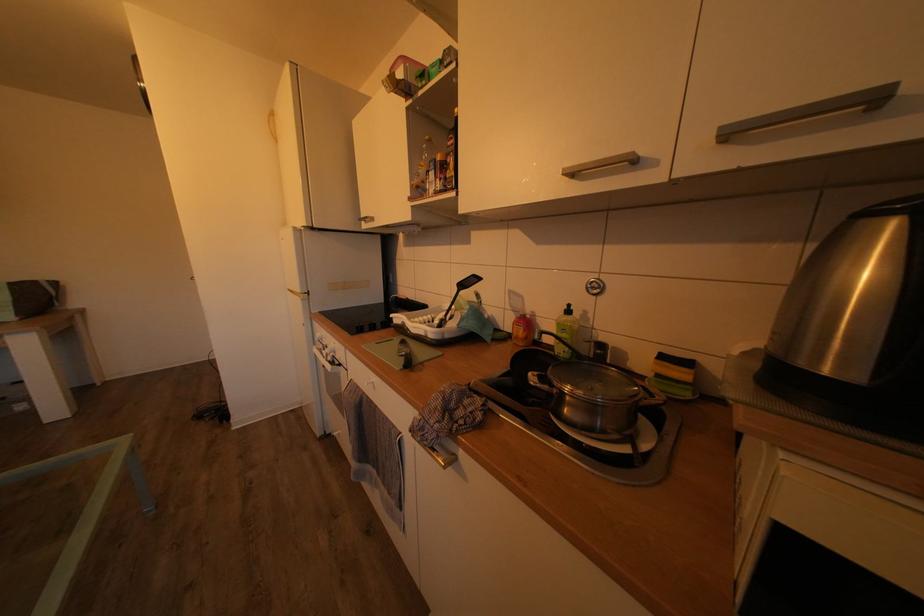
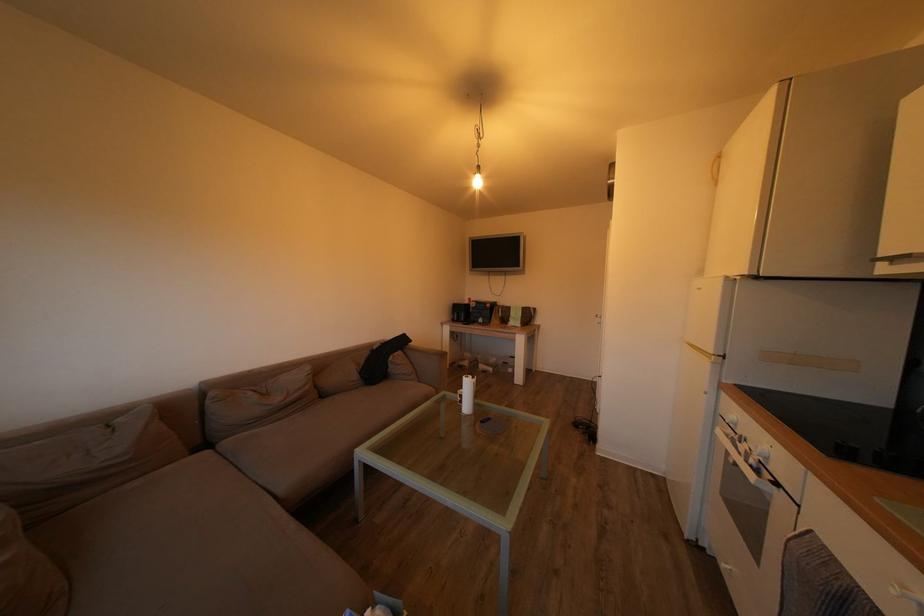
In the second image, find the point that corresponds to pixel 337 354 in the first image.

(759, 451)